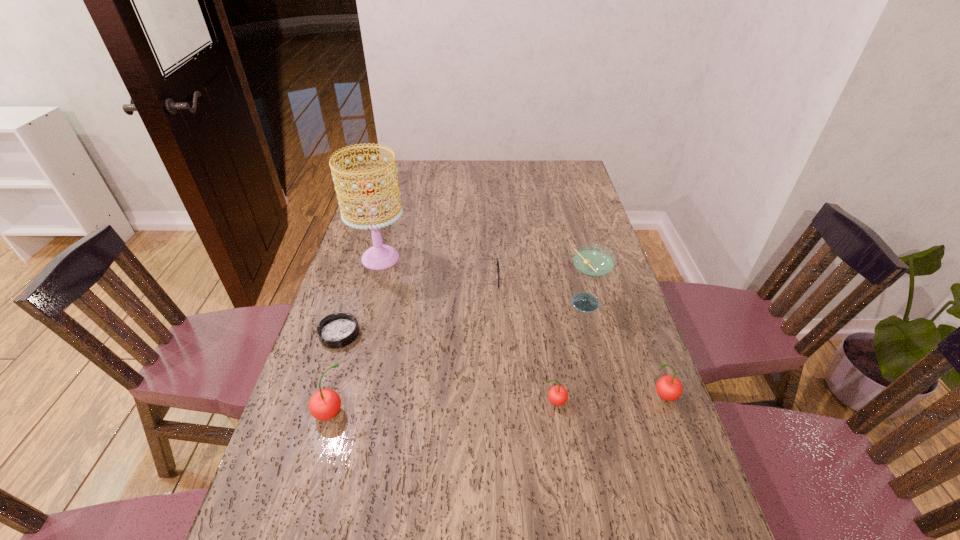
Image resolution: width=960 pixels, height=540 pixels. What are the coordinates of `ashtray` in the screenshot? It's located at (337, 330).

The height and width of the screenshot is (540, 960). Find the location of `the sixth tallest object`. the sixth tallest object is located at coordinates (498, 271).

At what (x,y) coordinates should I click in order to perform the action: click on the fourth object from right to left. Please return your answer as a coordinate pair (x, y). This screenshot has height=540, width=960. Looking at the image, I should click on (498, 271).

You are a GUI agent. You are given a task and a screenshot of the screen. Output one action in this format:
    pyautogui.click(x=<x>, y=<y>)
    Task: Click on the vacant space located on the right of the leftmost cherry
    This screenshot has height=540, width=960.
    Given the screenshot: What is the action you would take?
    tap(495, 414)

This screenshot has height=540, width=960. Find the location of `vacant area located on the right of the shortest cherry`. vacant area located on the right of the shortest cherry is located at coordinates [640, 402].

Identify the location of free space located 0.130m on the left of the second tallest cherry. This screenshot has height=540, width=960. (594, 396).

Find the location of a particular element. Image resolution: width=960 pixels, height=540 pixels. free space located 0.300m on the back of the sixth object from left to right is located at coordinates (567, 233).

The width and height of the screenshot is (960, 540). In order to click on vacant point located on the front of the lampshade in this screenshot , I will do `click(368, 303)`.

At what (x,y) coordinates should I click in order to perform the action: click on vacant space located on the front of the shortest object. Please return your answer as a coordinate pair (x, y). The width and height of the screenshot is (960, 540). Looking at the image, I should click on (289, 492).

Where is `vacant region located through the lenses of the second shortest object`? This screenshot has width=960, height=540. vacant region located through the lenses of the second shortest object is located at coordinates (615, 280).